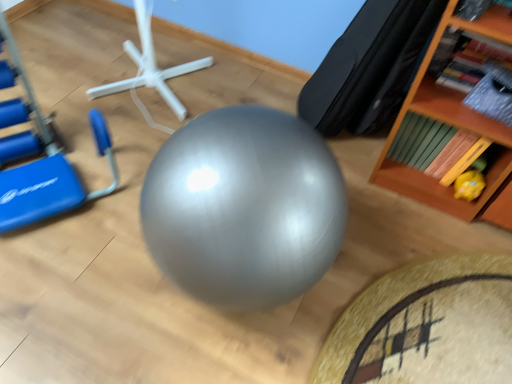
Locate an element on the screen. The width and height of the screenshot is (512, 384). free location to the left of white plastic stand at center is located at coordinates (55, 63).